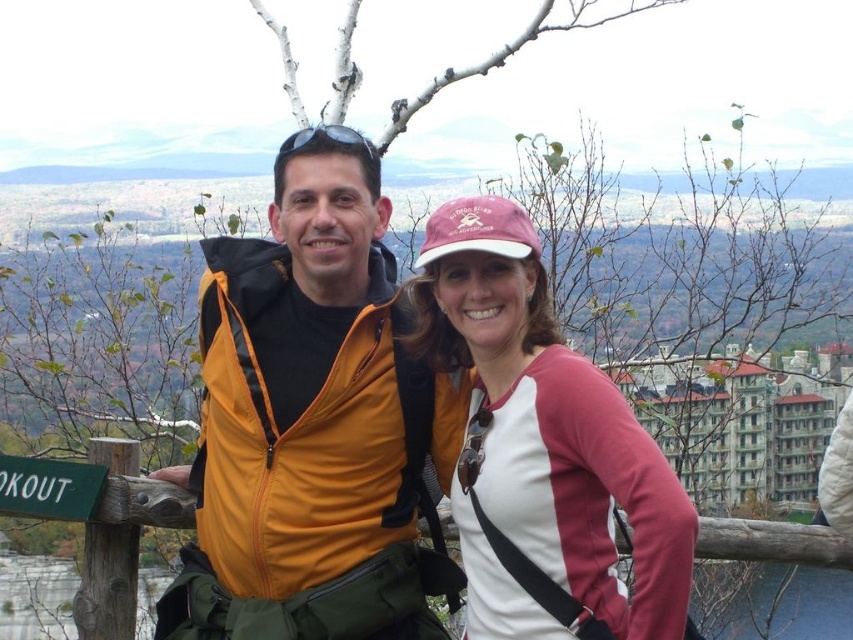
You are at the scenic overlook and want to take a photo of both the point at (305, 480) and the point at (556, 397). Based on their positions, which point is farther away from you?

Point at (305, 480) is behind point at (556, 397), so it is farther away from you.

You are an observer at the overlook and want to know which object is wider between the pink fabric baseball cap at upper center and the green wood sign at lower left. Please state which one is wider without mentioning their exact measurements.

The pink fabric baseball cap at upper center is wider than the green wood sign at lower left according to the description.

You are a photographer trying to capture both the yellow softshell jacket at center and the green wood sign at lower left in the same frame. Based on their sizes in the image, which object would appear larger in your photo?

The yellow softshell jacket at center appears larger in the photo because it is much taller than the green wood sign at lower left.